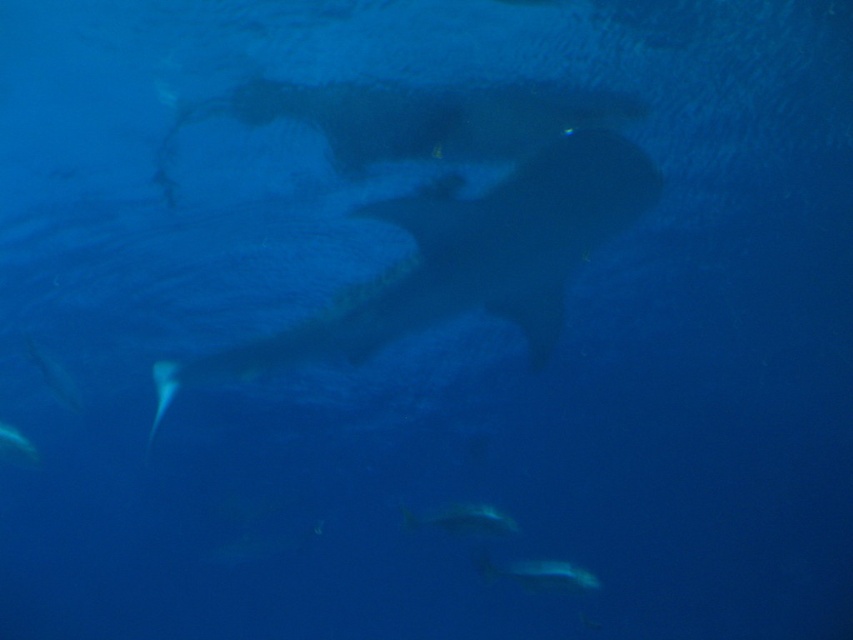
Which is in front, point (409, 296) or point (521, 580)?

Positioned in front is point (409, 296).

Who is more distant from viewer, [230,358] or [573,572]?

Point [230,358]

The image size is (853, 640). Find the location of `dark gray matte shark at center`. dark gray matte shark at center is located at coordinates (460, 262).

Does dark gray matte shark at center have a greater height compared to translucent blue fish at lower left?

Yes, dark gray matte shark at center is taller than translucent blue fish at lower left.

Is dark gray matte shark at center thinner than translucent blue fish at lower left?

Incorrect, dark gray matte shark at center's width is not less than translucent blue fish at lower left's.

This screenshot has width=853, height=640. Identify the location of dark gray matte shark at center. (x=460, y=262).

Is translucent blue fish at lower center smaller than shiny silver fish at center?

Actually, translucent blue fish at lower center might be larger than shiny silver fish at center.

Can you confirm if translucent blue fish at lower center is shorter than shiny silver fish at center?

In fact, translucent blue fish at lower center may be taller than shiny silver fish at center.

Which is in front, point (511, 564) or point (404, 509)?

Positioned in front is point (511, 564).

Locate an element on the screen. This screenshot has height=640, width=853. translucent blue fish at lower center is located at coordinates (541, 573).